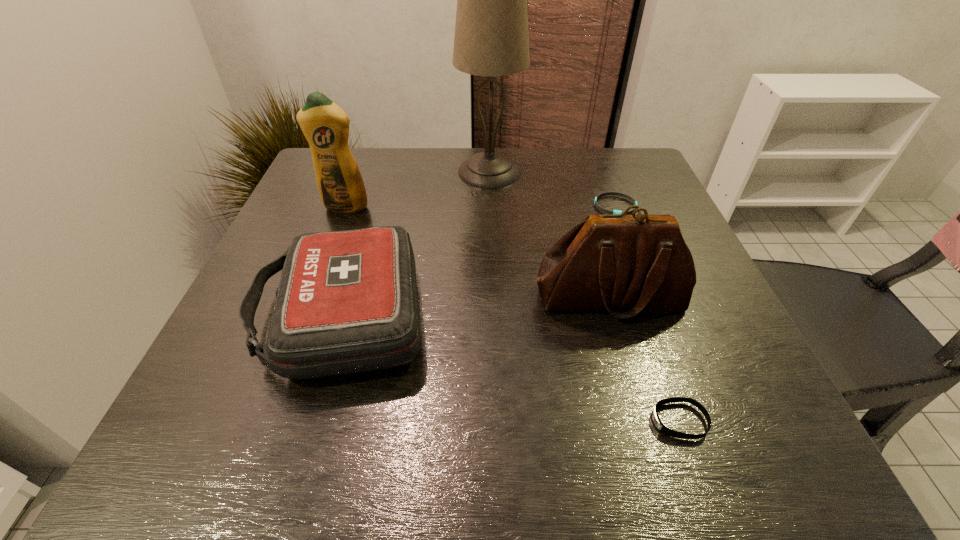
The image size is (960, 540). What are the coordinates of `vacant region located on the front-facing side of the farthest object` in the screenshot? It's located at (394, 172).

The height and width of the screenshot is (540, 960). Identify the location of vacant area situated 0.320m on the front-facing side of the farthest object. (337, 172).

At what (x,y) coordinates should I click in order to perform the action: click on vacant point located on the label of the detergent. Please return your answer as a coordinate pair (x, y). This screenshot has width=960, height=540. Looking at the image, I should click on (308, 306).

Where is `vacant space located on the front of the fourth shortest object`? vacant space located on the front of the fourth shortest object is located at coordinates (627, 353).

Where is `free region located 0.280m on the right of the first-aid kit`? free region located 0.280m on the right of the first-aid kit is located at coordinates (579, 315).

At what (x,y) coordinates should I click in order to perform the action: click on vacant space situated on the display of the nearer wristband. Please return your answer as a coordinate pair (x, y). The width and height of the screenshot is (960, 540). Looking at the image, I should click on (400, 421).

Where is `free point located on the display of the nearer wristband`? free point located on the display of the nearer wristband is located at coordinates (480, 421).

At what (x,y) coordinates should I click in order to perform the action: click on vacant space situated on the display of the nearer wristband. Please return your answer as a coordinate pair (x, y). Looking at the image, I should click on (387, 421).

You are a GUI agent. You are given a task and a screenshot of the screen. Output one action in this format:
    pyautogui.click(x=<x>, y=<y>)
    Task: Click on the vacant space situated 0.380m on the buckle of the farther wristband
    
    Given the screenshot: What is the action you would take?
    pyautogui.click(x=670, y=349)

The height and width of the screenshot is (540, 960). In order to click on lampshade located in the far edge section of the desktop in this screenshot , I will do `click(491, 39)`.